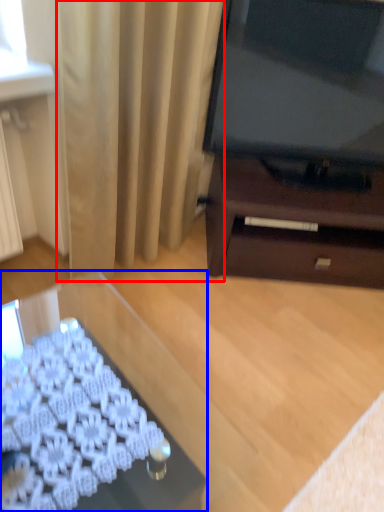
Question: Which object is further to the camera taking this photo, curtain (highlighted by a red box) or desk (highlighted by a blue box)?

Choices:
 (A) curtain
 (B) desk

Answer: (A)